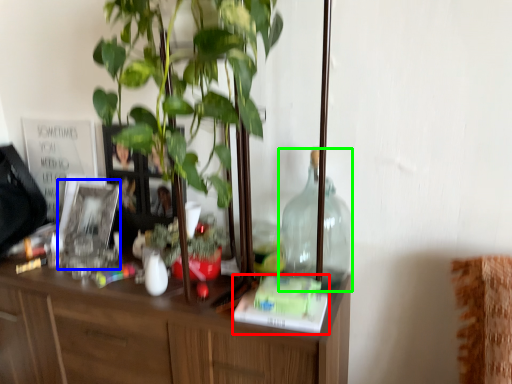
Question: Estimate the real-world distances between objects in this image. Which object is closer to book (highlighted by a red box), picture frame (highlighted by a blue box) or bottle (highlighted by a green box)?

Choices:
 (A) picture frame
 (B) bottle

Answer: (B)